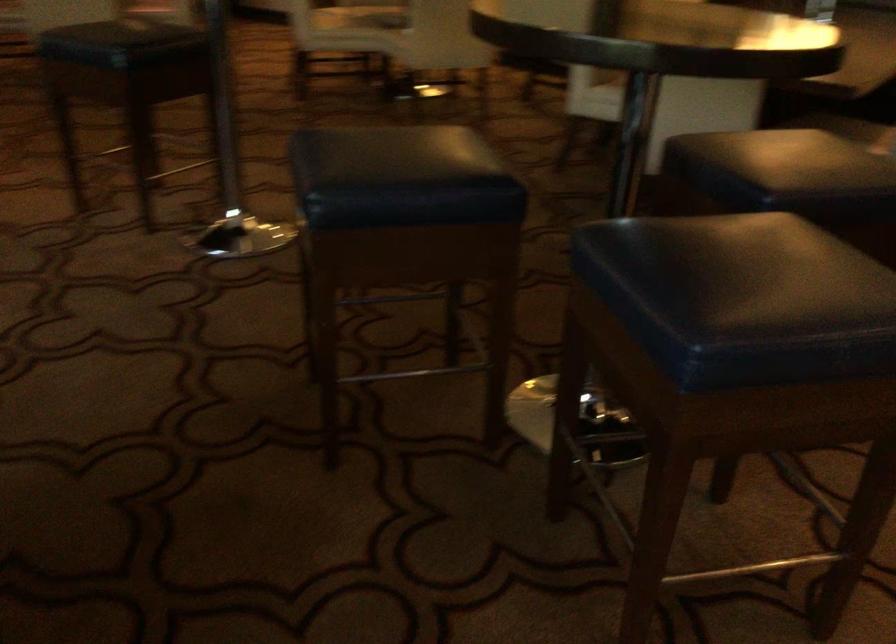
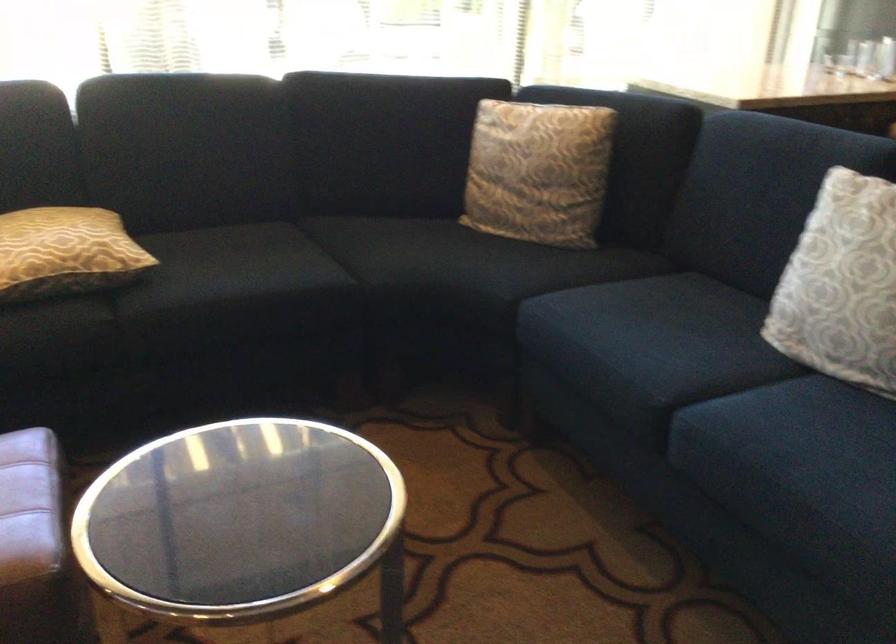
Based on the continuous images, in which direction is the camera rotating?

The camera rotated toward left-down.